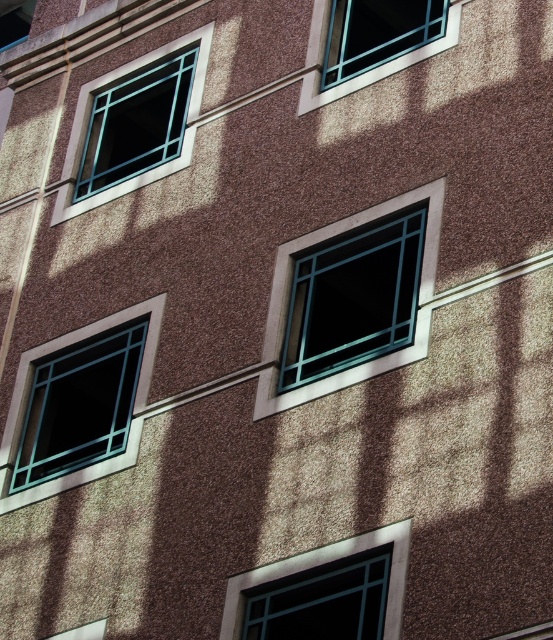
You are an architect designing a new building and want to ensure that the green glass window at center and the matte glass window at upper left are proportionate. Based on the image, which window should be adjusted to match the size of the other?

The green glass window at center is larger than the matte glass window at upper left. To make them proportionate, the matte glass window at upper left should be made larger to match the size of the green glass window at center.

You are an architect evaluating the building facade. You notice the green glass window at center and the matte glass window at lower left. Which window takes up more area on the wall?

The matte glass window at lower left occupies more space than the green glass window at center, so the matte glass window at lower left takes up more area on the wall.

You are an architect analyzing the building facade. You notice two windows, the matte glass window at lower right and the matte glass window at upper left. Which of these two windows has a greater height?

The matte glass window at lower right is taller than the matte glass window at upper left, so it has a greater height.